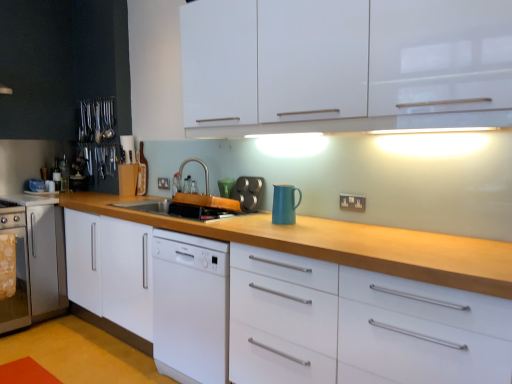
Question: Can you confirm if black plastic electric outlet at center, which ranks as the second electric outlet in front-to-back order, is positioned to the right of stainless steel oven at left, arranged as the first appliance when viewed from the back?

Choices:
 (A) yes
 (B) no

Answer: (A)

Question: Does black plastic electric outlet at center, the second electric outlet positioned from the right, have a lesser width compared to stainless steel oven at left, the 2th appliance in the right-to-left sequence?

Choices:
 (A) no
 (B) yes

Answer: (B)

Question: From the image's perspective, does black plastic electric outlet at center, which ranks as the first electric outlet in left-to-right order, appear lower than stainless steel oven at left, the 2th appliance in the right-to-left sequence?

Choices:
 (A) yes
 (B) no

Answer: (B)

Question: Considering the relative sizes of black plastic electric outlet at center, positioned as the first electric outlet in top-to-bottom order, and stainless steel oven at left, the first appliance when ordered from bottom to top, in the image provided, is black plastic electric outlet at center, positioned as the first electric outlet in top-to-bottom order, smaller than stainless steel oven at left, the first appliance when ordered from bottom to top,?

Choices:
 (A) no
 (B) yes

Answer: (B)

Question: From a real-world perspective, is black plastic electric outlet at center, which ranks as the first electric outlet in left-to-right order, positioned over stainless steel oven at left, the 2th appliance in the right-to-left sequence, based on gravity?

Choices:
 (A) no
 (B) yes

Answer: (B)

Question: Considering the positions of white glossy drawer at center and black plastic electric outlet at center, which is the 2th electric outlet from bottom to top, in the image, is white glossy drawer at center wider or thinner than black plastic electric outlet at center, which is the 2th electric outlet from bottom to top,?

Choices:
 (A) wide
 (B) thin

Answer: (A)

Question: Is white glossy drawer at center in front of or behind black plastic electric outlet at center, which ranks as the second electric outlet in front-to-back order, in the image?

Choices:
 (A) behind
 (B) front

Answer: (B)

Question: Do you think white glossy drawer at center is within black plastic electric outlet at center, which ranks as the second electric outlet in front-to-back order, or outside of it?

Choices:
 (A) outside
 (B) inside

Answer: (A)

Question: Considering the positions of point (486, 337) and point (164, 188), is point (486, 337) closer or farther from the camera than point (164, 188)?

Choices:
 (A) farther
 (B) closer

Answer: (B)

Question: Is white glossy cabinet at upper center taller or shorter than white glossy drawer at center?

Choices:
 (A) tall
 (B) short

Answer: (B)

Question: From a real-world perspective, is white glossy cabinet at upper center physically located above or below white glossy drawer at center?

Choices:
 (A) above
 (B) below

Answer: (A)

Question: Is white glossy cabinet at upper center bigger or smaller than white glossy drawer at center?

Choices:
 (A) big
 (B) small

Answer: (B)

Question: In terms of width, does white glossy cabinet at upper center look wider or thinner when compared to white glossy drawer at center?

Choices:
 (A) thin
 (B) wide

Answer: (A)

Question: In the image, is black plastic electric outlet at center, which ranks as the first electric outlet in left-to-right order, on the left side or the right side of black plastic electrical outlet at center-right, arranged as the first electric outlet when ordered from the bottom?

Choices:
 (A) right
 (B) left

Answer: (B)

Question: Is black plastic electric outlet at center, which ranks as the first electric outlet in left-to-right order, inside the boundaries of black plastic electrical outlet at center-right, arranged as the first electric outlet when ordered from the bottom, or outside?

Choices:
 (A) outside
 (B) inside

Answer: (A)